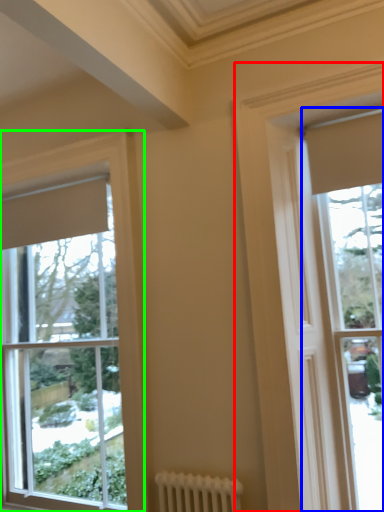
Question: Which object is the farthest from window (highlighted by a red box)? Choose among these: window (highlighted by a blue box) or window (highlighted by a green box).

Choices:
 (A) window
 (B) window

Answer: (B)